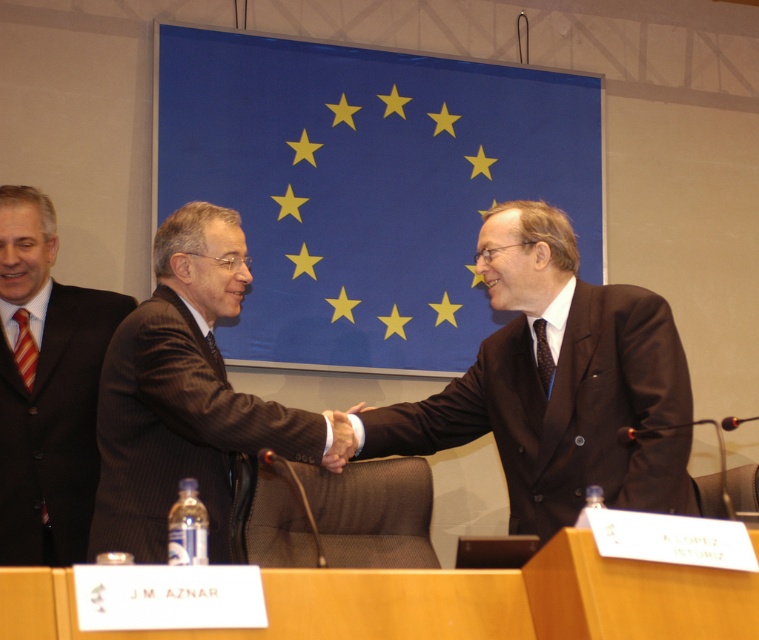
Question: Which point is closer to the camera taking this photo?

Choices:
 (A) (109, 333)
 (B) (106, 465)
 (C) (584, 284)

Answer: (B)

Question: Which point appears farthest from the camera in this image?

Choices:
 (A) (376, 426)
 (B) (46, 216)

Answer: (B)

Question: Which object is farther from the camera taking this photo?

Choices:
 (A) brown pinstripe suit at center
 (B) matte black suit at left

Answer: (B)

Question: Does brown pinstripe suit at center appear over matte black suit at left?

Choices:
 (A) yes
 (B) no

Answer: (A)

Question: Can you confirm if dark brown suit at center is positioned below brown pinstripe suit at center?

Choices:
 (A) yes
 (B) no

Answer: (B)

Question: Is dark brown suit at center further to the viewer compared to matte black suit at left?

Choices:
 (A) yes
 (B) no

Answer: (B)